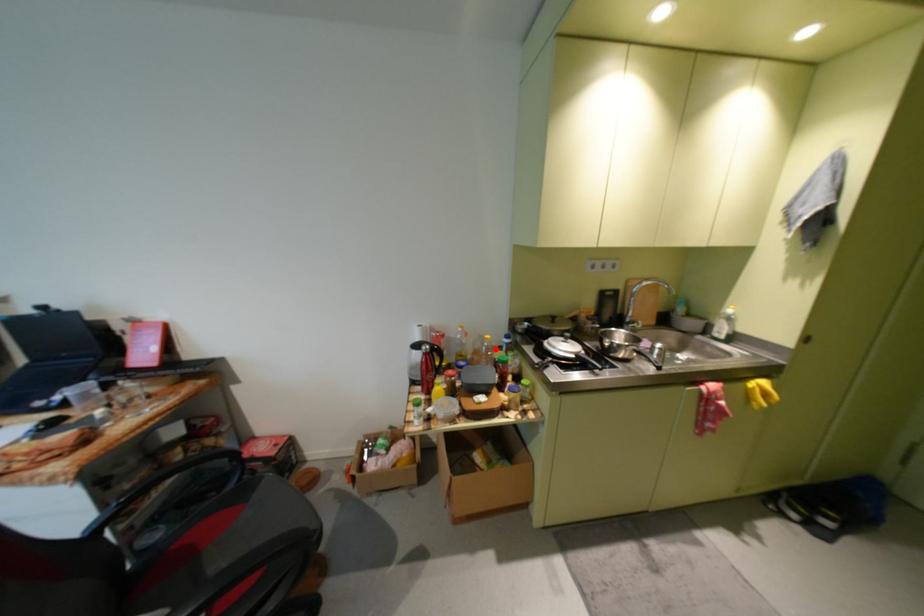
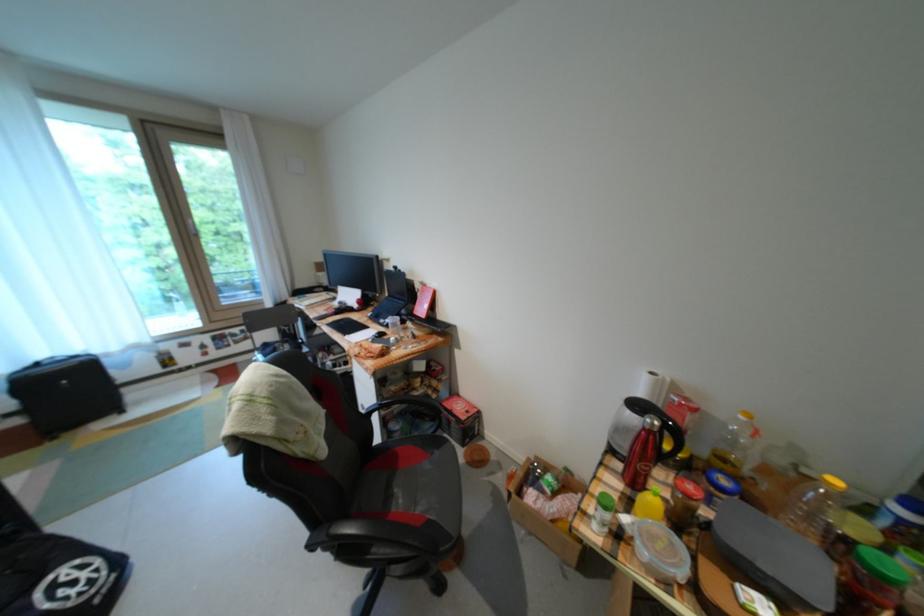
Question: A red point is marked in image1. In image2, is the corresponding 3D point closer to the camera or farther? Reply with the corresponding letter.

Choices:
 (A) The corresponding 3D point is closer.
 (B) The corresponding 3D point is farther.

Answer: (A)